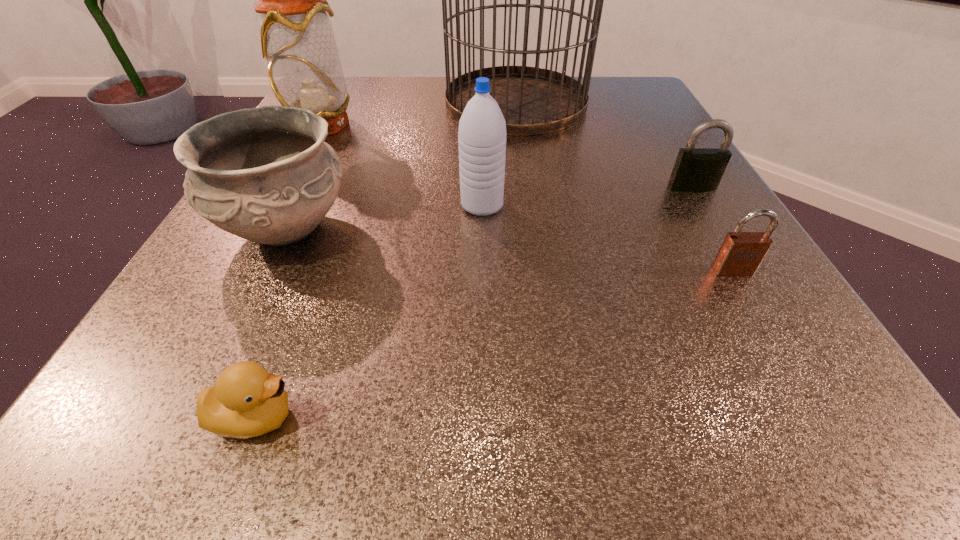
Identify the location of vacant region located on the front of the birdcage. The height and width of the screenshot is (540, 960). [x=527, y=185].

You are a GUI agent. You are given a task and a screenshot of the screen. Output one action in this format:
    pyautogui.click(x=<x>, y=<y>)
    Task: Click on the vacant space situated on the back of the second tallest object
    This screenshot has height=540, width=960.
    Given the screenshot: What is the action you would take?
    pyautogui.click(x=347, y=78)

You are a GUI agent. You are given a task and a screenshot of the screen. Output one action in this format:
    pyautogui.click(x=<x>, y=<y>)
    Task: Click on the vacant region located on the right of the fifth shortest object
    The image size is (960, 540).
    Given the screenshot: What is the action you would take?
    pyautogui.click(x=718, y=205)

Identify the location of vacant space located 0.320m on the right of the fourth shortest object. click(x=566, y=227).

Locate an element on the screen. This screenshot has width=960, height=540. vacant space located on the left of the fifth tallest object is located at coordinates (453, 187).

Image resolution: width=960 pixels, height=540 pixels. I want to click on vacant region located on the front-facing side of the second shortest object, so click(x=767, y=329).

Image resolution: width=960 pixels, height=540 pixels. Identify the location of vacant region located on the face of the nearest object. (588, 416).

I want to click on birdcage that is at the far edge, so click(x=533, y=100).

At what (x,y) coordinates should I click in order to perform the action: click on oil lamp situated at the far edge. Please return your answer as a coordinate pair (x, y). Looking at the image, I should click on (297, 39).

Find the location of `object present at the near edge`. object present at the near edge is located at coordinates (247, 401).